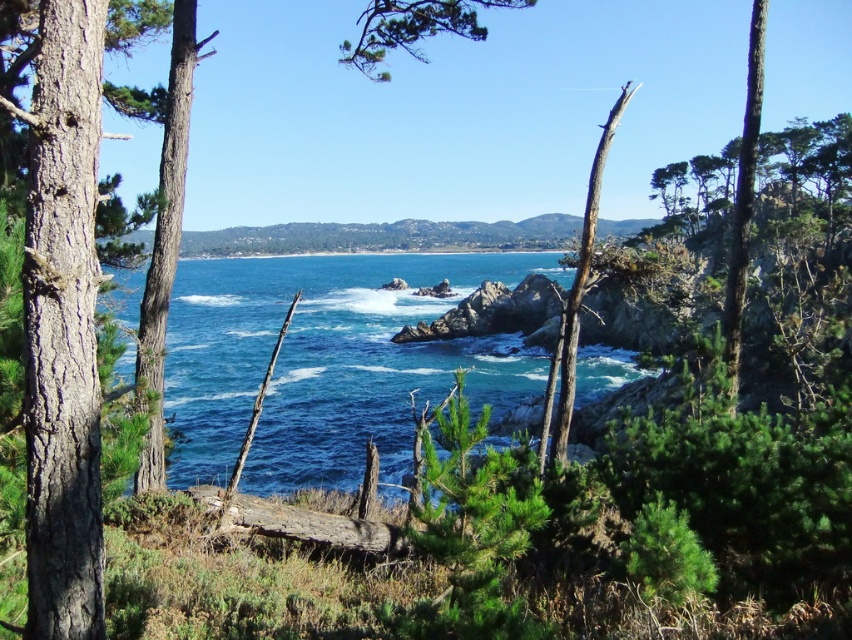
Question: Can you confirm if brown rough bark tree at left is positioned to the right of brown rough bark tree at center?

Choices:
 (A) yes
 (B) no

Answer: (B)

Question: Which object appears farthest from the camera in this image?

Choices:
 (A) smooth bark tree at left
 (B) brown rough bark tree at left
 (C) green textured pine tree at center
 (D) green rough bark tree at right

Answer: (D)

Question: Is green textured pine tree at center positioned behind smooth bark tree at left?

Choices:
 (A) no
 (B) yes

Answer: (A)

Question: Does blue smooth water at center come behind green textured pine tree at center?

Choices:
 (A) no
 (B) yes

Answer: (B)

Question: Which point is farther to the camera?

Choices:
 (A) smooth bark tree at left
 (B) green rough bark tree at right
 (C) blue smooth water at center

Answer: (B)

Question: Which object appears closest to the camera in this image?

Choices:
 (A) green needle-like leaves at upper center
 (B) green rough bark tree at right
 (C) smooth bark tree at left

Answer: (C)